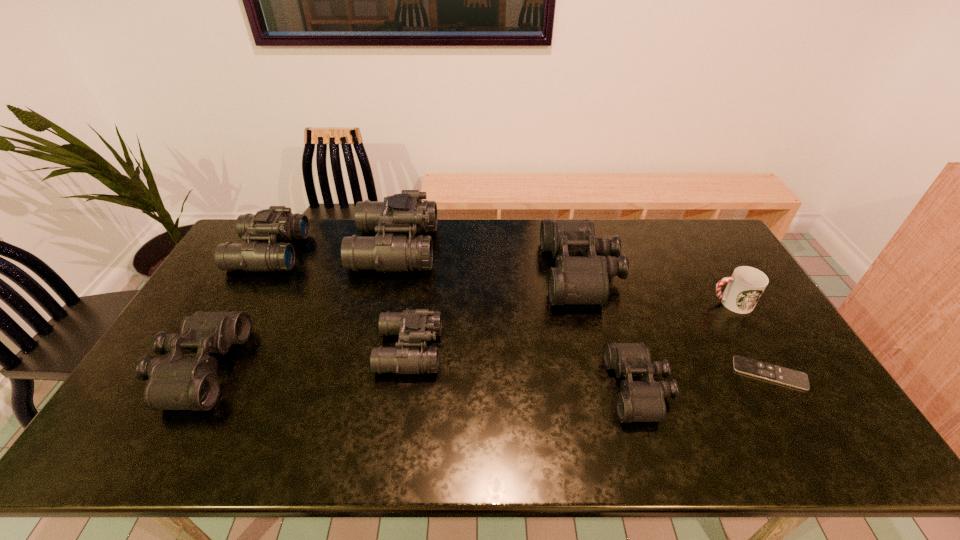
At what (x,y) coordinates should I click in order to perform the action: click on vacant position at the left edge of the desktop. Please return your answer as a coordinate pair (x, y). This screenshot has width=960, height=540. Looking at the image, I should click on (218, 357).

In the image, there is a desktop. Where is `vacant space at the right edge`? This screenshot has height=540, width=960. vacant space at the right edge is located at coordinates (784, 392).

Image resolution: width=960 pixels, height=540 pixels. What are the coordinates of `vacant area at the far right corner of the desktop` in the screenshot? It's located at (698, 258).

In the image, there is a desktop. Where is `vacant space at the near right corner`? Image resolution: width=960 pixels, height=540 pixels. vacant space at the near right corner is located at coordinates (829, 433).

Find the location of a particular element. The height and width of the screenshot is (540, 960). vacant point located between the remote control and the shortest binoculars is located at coordinates (704, 381).

Find the location of a particular element. vacant space that's between the second smallest black binoculars and the second biggest blue binoculars is located at coordinates (234, 310).

This screenshot has width=960, height=540. Identify the location of free space between the nearest blue binoculars and the biggest black binoculars. (495, 311).

At what (x,y) coordinates should I click in order to perform the action: click on vacant area that lies between the smallest blue binoculars and the farthest black binoculars. Please return your answer as a coordinate pair (x, y). This screenshot has height=540, width=960. Looking at the image, I should click on (495, 311).

Find the location of a particular element. This screenshot has height=540, width=960. vacant space in between the smallest black binoculars and the leftmost blue binoculars is located at coordinates (454, 320).

Where is `free space between the tallest object and the shortest binoculars`? free space between the tallest object and the shortest binoculars is located at coordinates (516, 318).